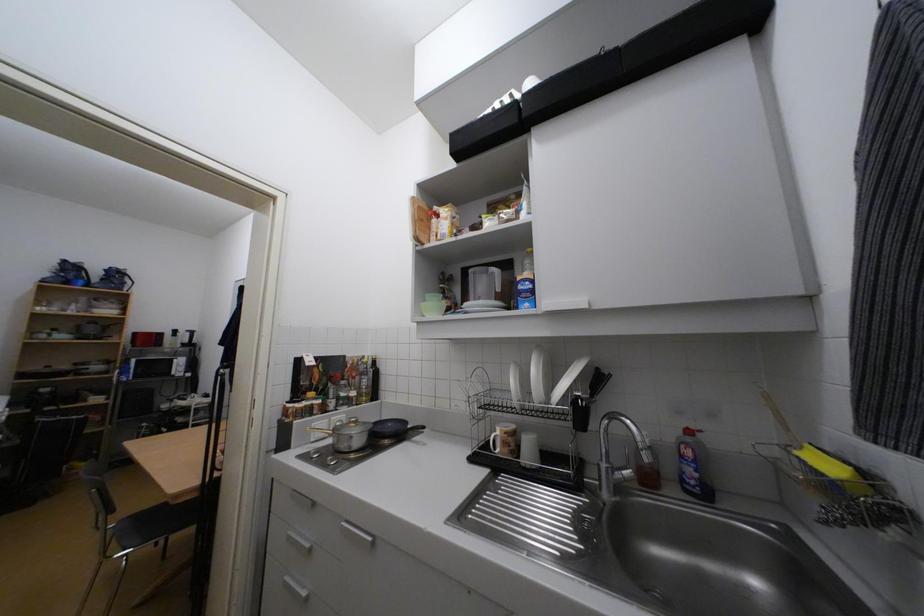
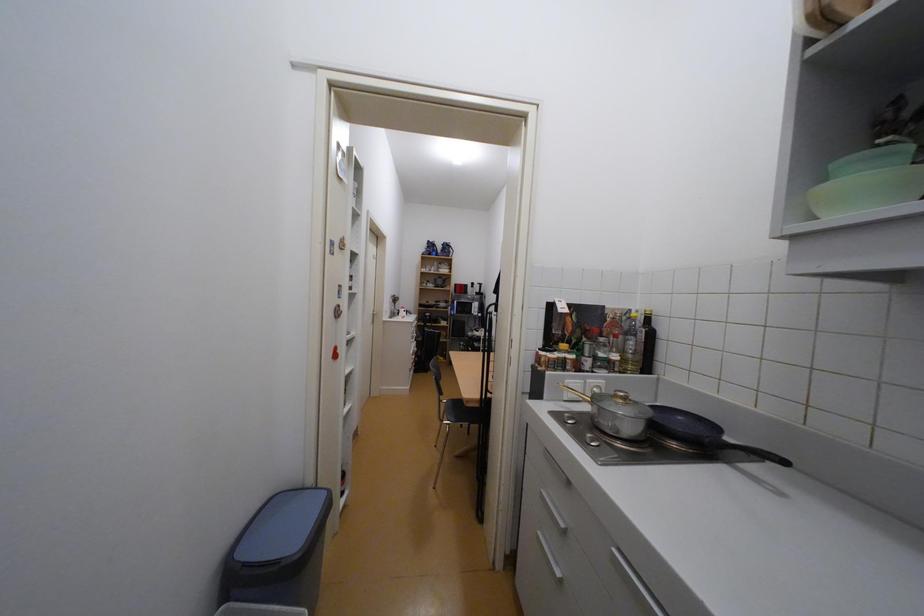
Question: The images are taken continuously from a first-person perspective. In which direction is your viewpoint rotating?

Choices:
 (A) Left
 (B) Right
 (C) Up
 (D) Down

Answer: (A)